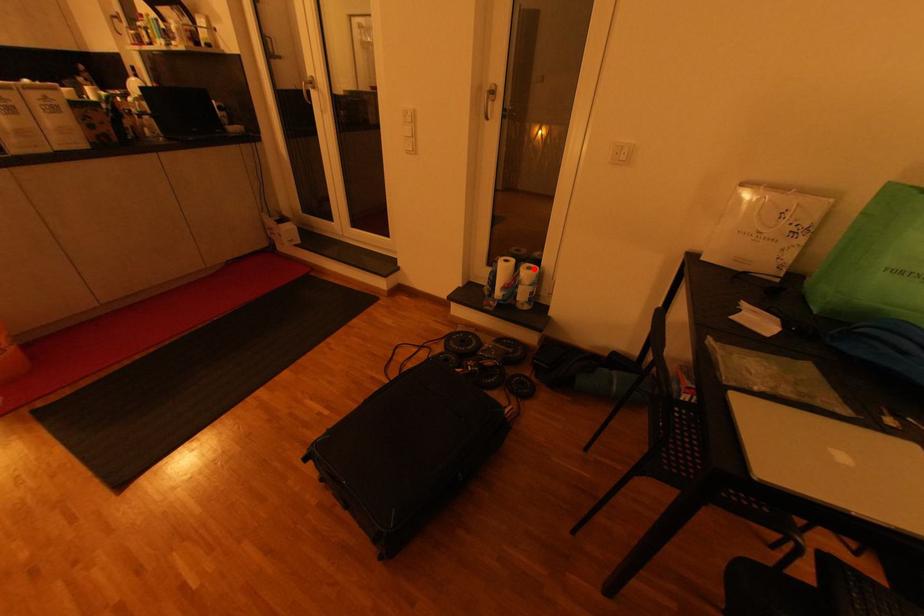
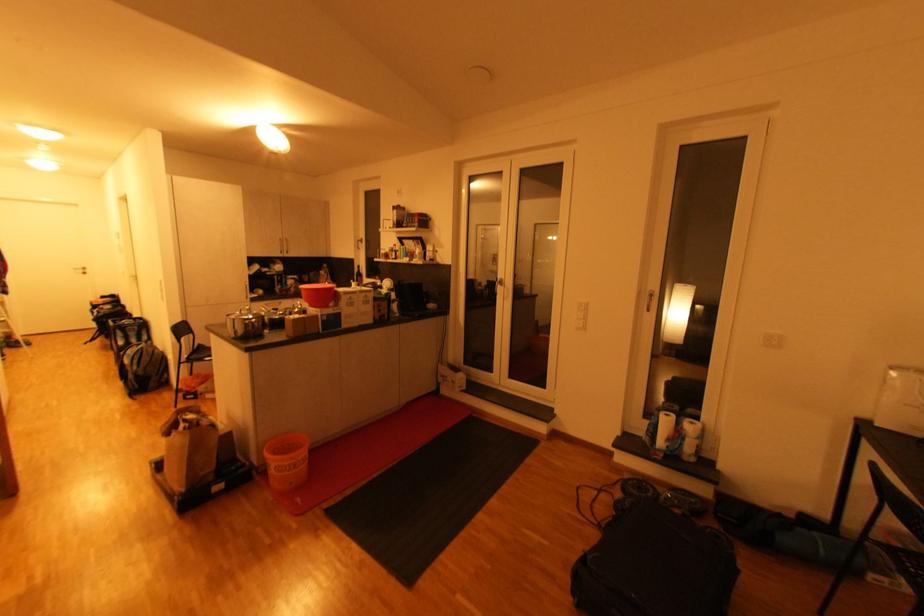
Where in the second image is the point corresponding to the highlighted location from the first image?

(698, 424)